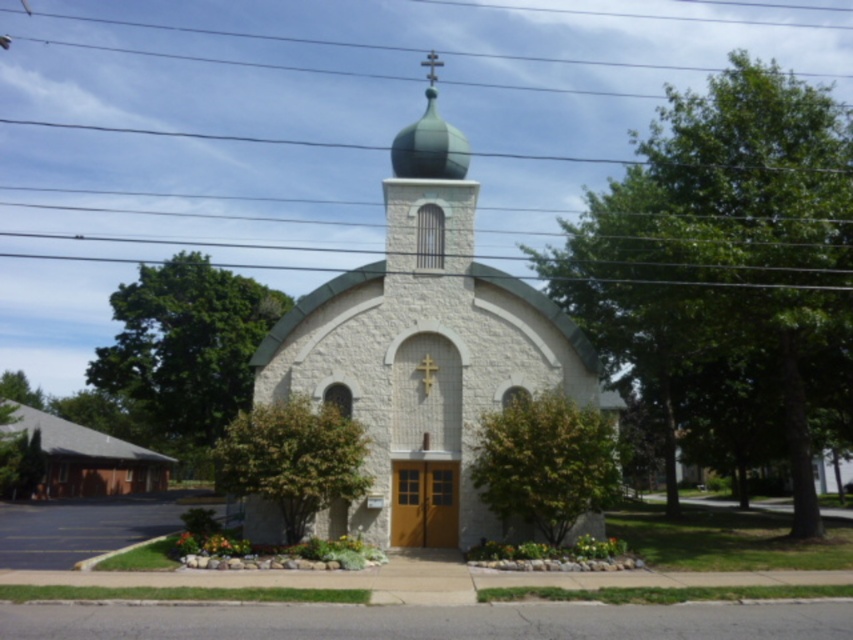
Question: Where is white stone church at center located in relation to green matte dome at center in the image?

Choices:
 (A) below
 (B) above

Answer: (A)

Question: Is white stone church at center positioned behind green matte dome at center?

Choices:
 (A) no
 (B) yes

Answer: (A)

Question: Which of the following is the farthest from the observer?

Choices:
 (A) green matte dome at center
 (B) white stone church at center

Answer: (A)

Question: Which of the following is the closest to the observer?

Choices:
 (A) white stone church at center
 (B) green matte dome at center

Answer: (A)

Question: Is white stone church at center thinner than green matte dome at center?

Choices:
 (A) no
 (B) yes

Answer: (A)